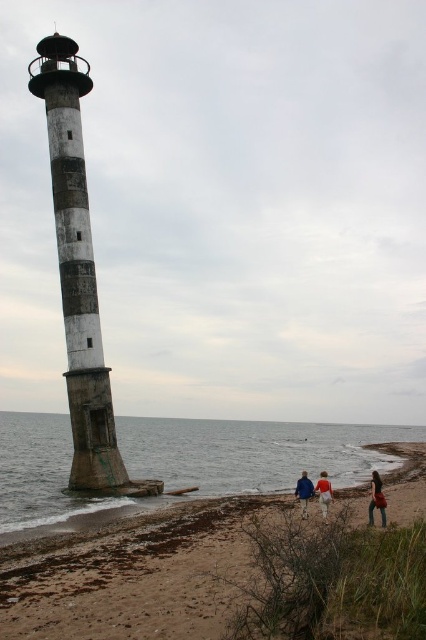
You are a photographer at the beach scene and want to capture both the denim jacket at lower right and the blue fabric jacket at lower center in a single frame. Which jacket should you focus on to ensure both are visible without zooming in or out?

The denim jacket at lower right is larger in size than the blue fabric jacket at lower center. To ensure both are visible without adjusting the zoom, focus on the denim jacket at lower right since it is the larger one and will remain in frame while the smaller blue fabric jacket at lower center will naturally fit within the same view.

Based on the photo, you are standing on the beach and want to take a photo of the brown sand at lower right and the concrete lighthouse at left. Which object will appear closer to the camera in the photo?

The brown sand at lower right will appear closer to the camera in the photo because it is in front of the concrete lighthouse at left.

You are standing at the lighthouse on the left side of the beach. You want to walk directly to the brown sand at lower right. What direction should you face to walk straight towards it?

You should face the direction towards the lower right to walk straight towards the brown sand at lower right since it is located at that position.